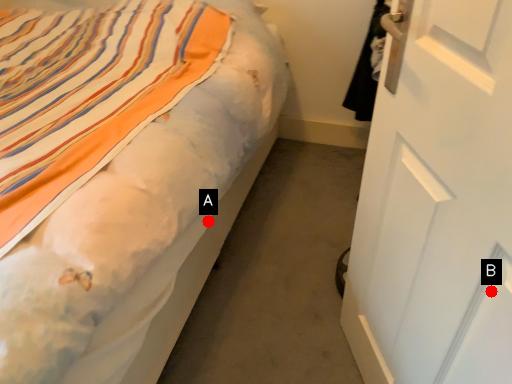
Question: Two points are circled on the image, labeled by A and B beside each circle. Which point appears farthest from the camera in this image?

Choices:
 (A) A is further
 (B) B is further

Answer: (A)